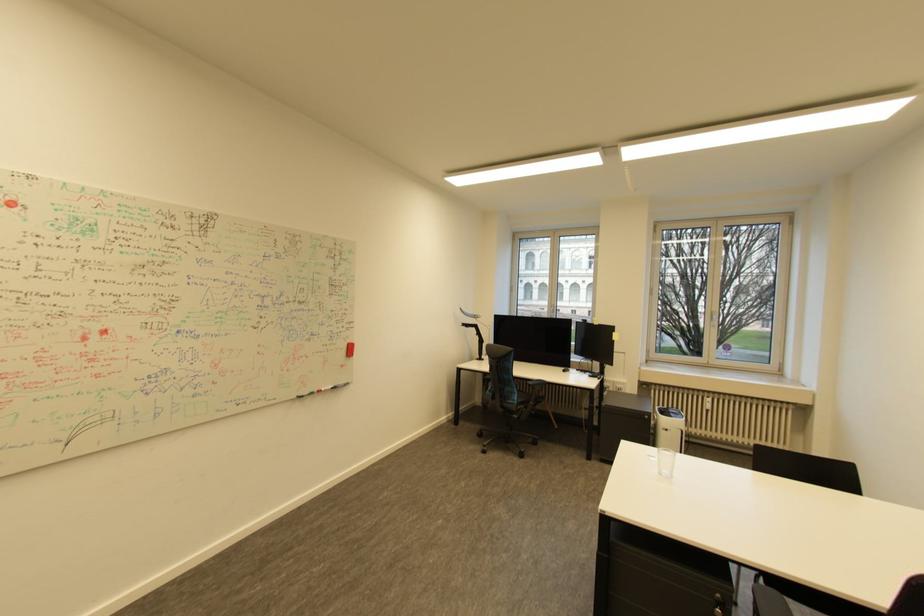
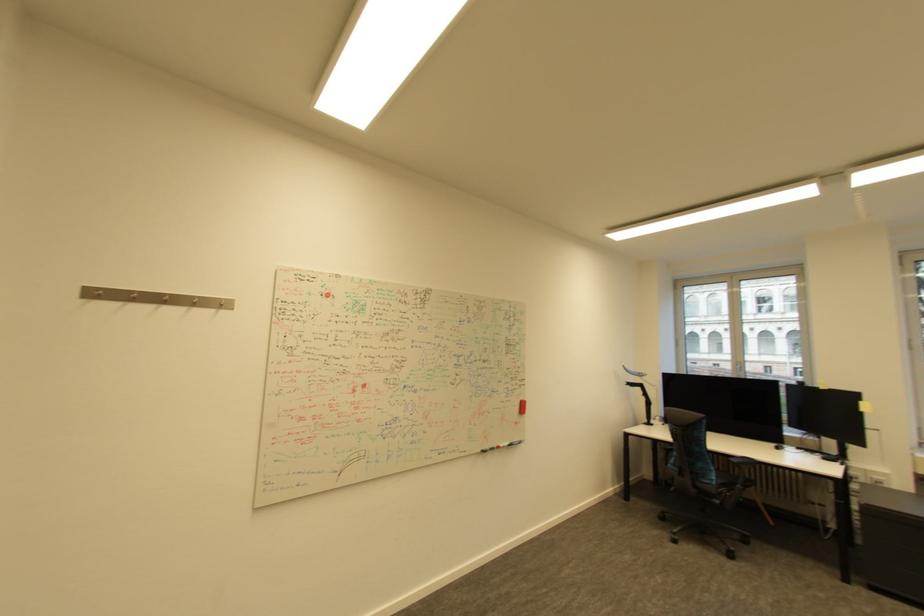
Question: The first image is from the beginning of the video and the second image is from the end. How did the camera likely rotate when shooting the video?

Choices:
 (A) Left
 (B) Right
 (C) Up
 (D) Down

Answer: (A)